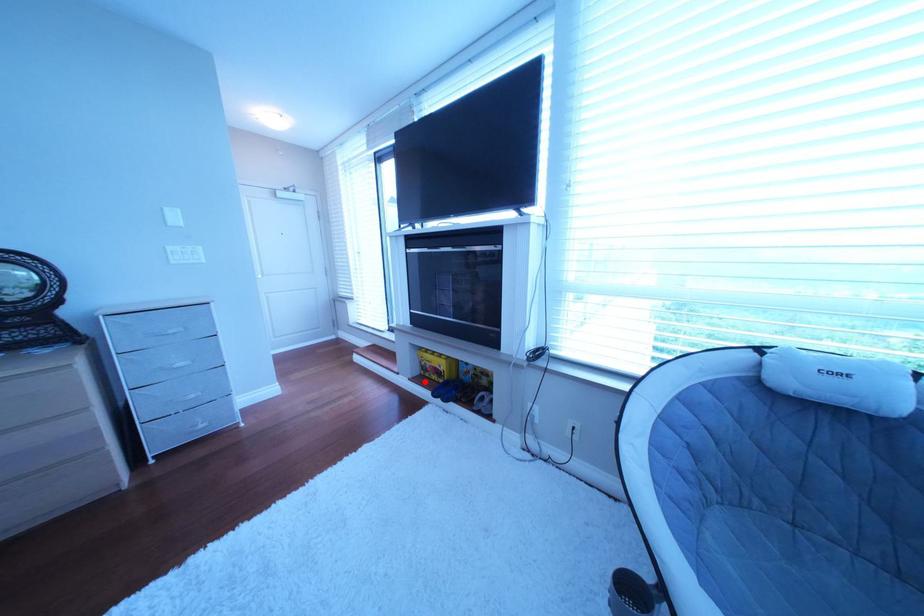
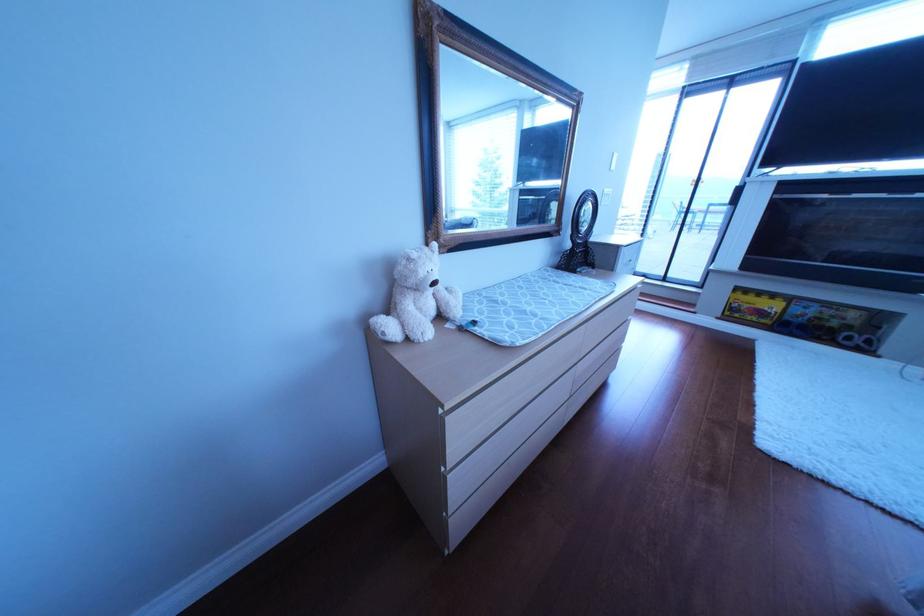
Find the pixel in the second image that matches the highlighted location in the first image.

(733, 320)